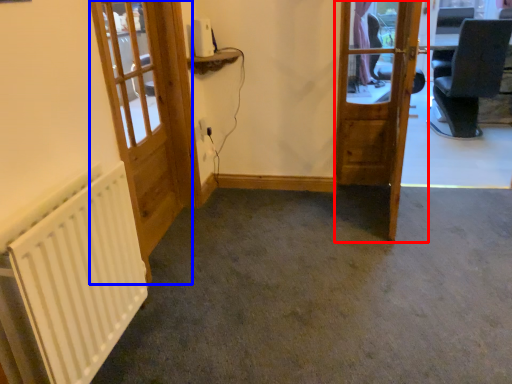
Question: Which of the following is the farthest to the observer, door (highlighted by a red box) or door (highlighted by a blue box)?

Choices:
 (A) door
 (B) door

Answer: (A)